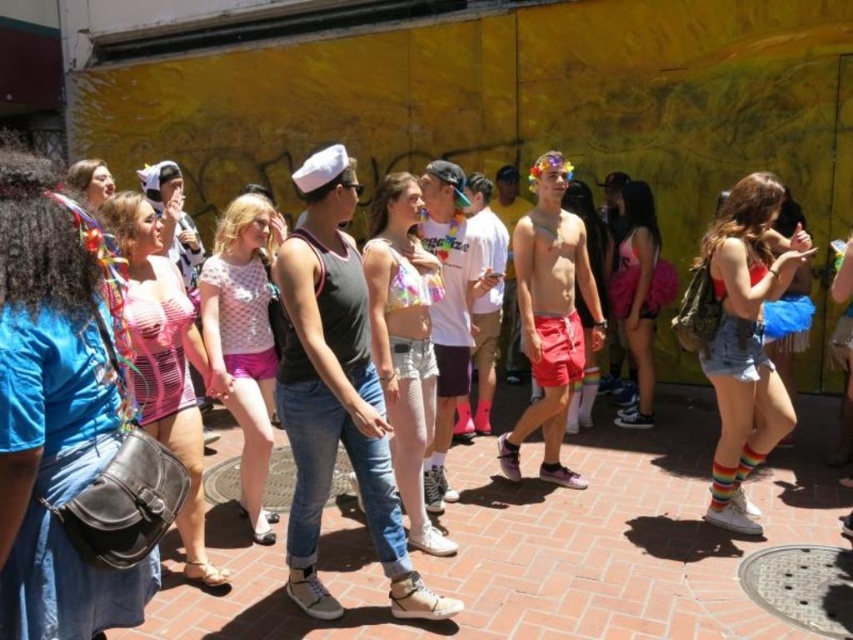
Question: Which is nearer to the rainbow fabric bikini top at center?

Choices:
 (A) matte pink bikini top at upper left
 (B) pink satin top at center
 (C) denim shorts at center
 (D) blue denim shirt at left

Answer: (B)

Question: Among these points, which one is nearest to the camera?

Choices:
 (A) (747, 179)
 (B) (172, 282)
 (C) (9, 474)
 (D) (457, 202)

Answer: (C)

Question: Is rainbow fabric bikini top at center in front of pink satin tutu at center?

Choices:
 (A) no
 (B) yes

Answer: (B)

Question: Which point is closer to the camera?

Choices:
 (A) (469, 269)
 (B) (97, 161)

Answer: (A)

Question: Can you confirm if pink satin top at center is thinner than pink satin shorts at center?

Choices:
 (A) yes
 (B) no

Answer: (B)

Question: Is rainbow fabric bikini top at center smaller than pink satin top at center?

Choices:
 (A) no
 (B) yes

Answer: (B)